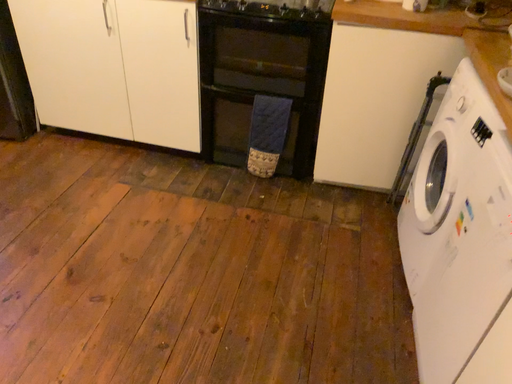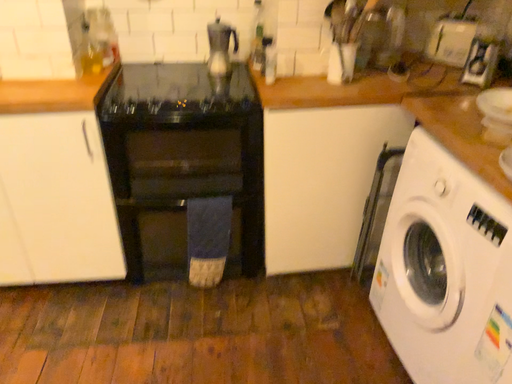
Question: How did the camera likely rotate when shooting the video?

Choices:
 (A) rotated downward
 (B) rotated upward

Answer: (B)